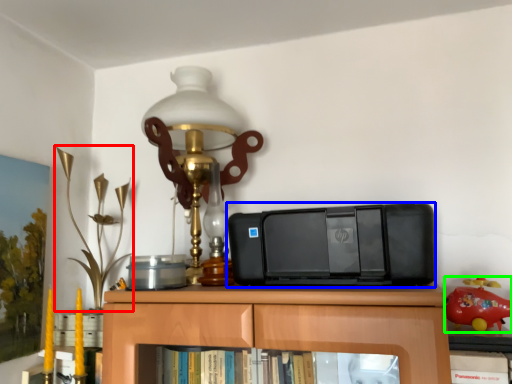
Question: Which object is positioned farthest from toy (highlighted by a red box)? Select from printer (highlighted by a blue box) and toy (highlighted by a green box).

Choices:
 (A) printer
 (B) toy

Answer: (B)